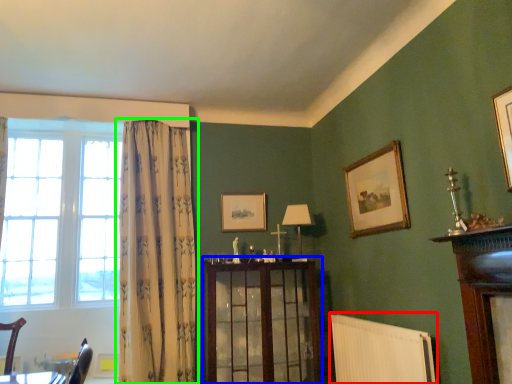
Question: Which object is positioned farthest from radiator (highlighted by a red box)? Select from dresser (highlighted by a blue box) and curtain (highlighted by a green box).

Choices:
 (A) dresser
 (B) curtain

Answer: (B)